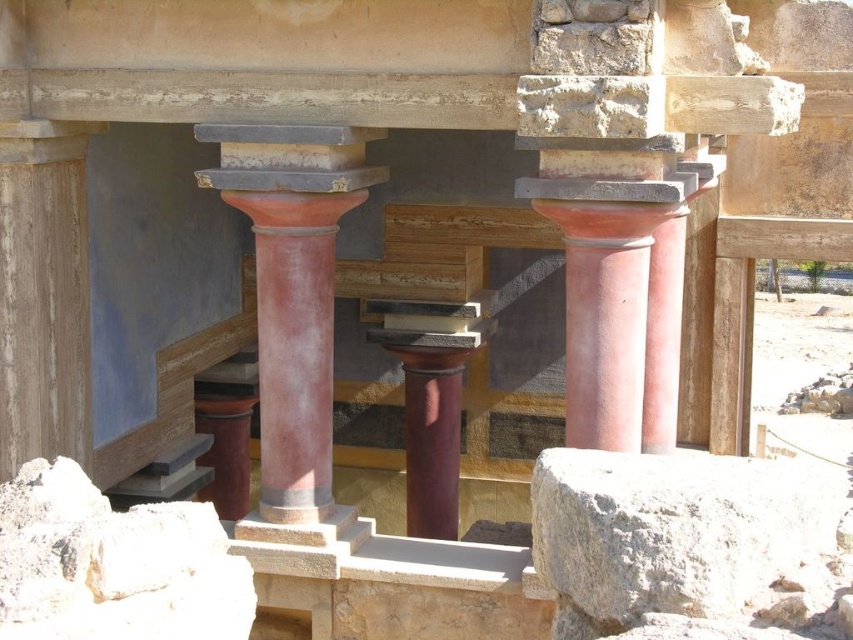
Looking at this image, is gray rough stone at lower right wider than matte terracotta column at center?

Yes, gray rough stone at lower right is wider than matte terracotta column at center.

Can you confirm if gray rough stone at lower right is taller than matte terracotta column at center?

No.

The height and width of the screenshot is (640, 853). What do you see at coordinates (670, 529) in the screenshot?
I see `gray rough stone at lower right` at bounding box center [670, 529].

Where is `gray rough stone at lower right`? gray rough stone at lower right is located at coordinates (670, 529).